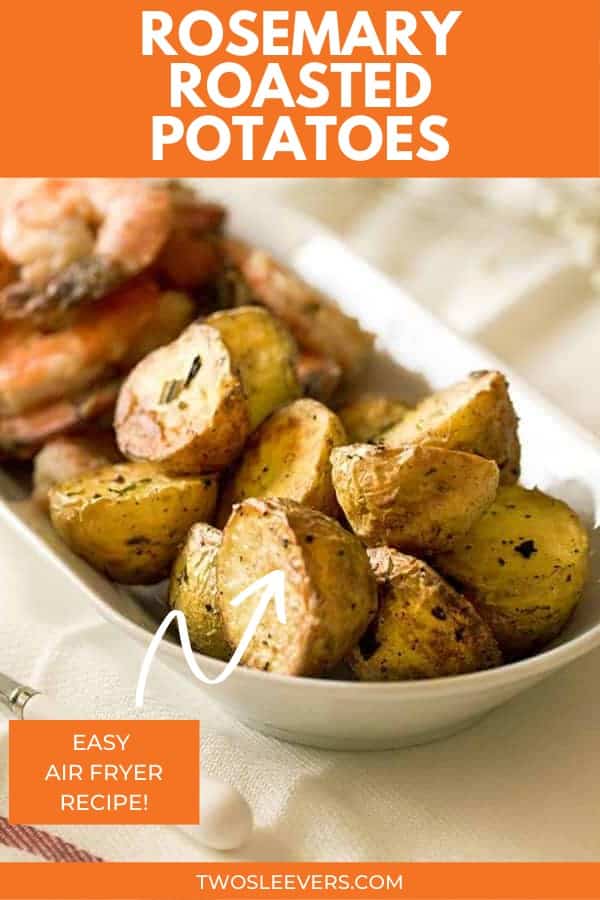
In order to click on dish in this screenshot , I will do `click(359, 702)`.